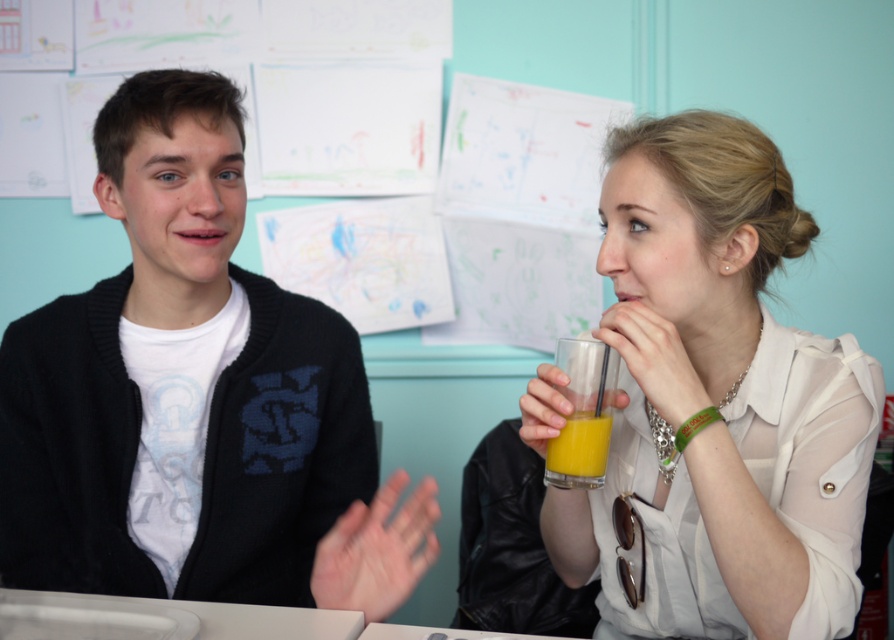
Does white glossy shirt at upper right come in front of translucent glass of orange juice at center?

Yes, it is.

Between white glossy shirt at upper right and translucent glass of orange juice at center, which one appears on the left side from the viewer's perspective?

Positioned to the left is translucent glass of orange juice at center.

I want to click on white glossy shirt at upper right, so click(x=718, y=401).

Is point (114, 120) farther from viewer compared to point (85, 595)?

Yes.

Which is in front, point (97, 160) or point (171, 605)?

Point (171, 605) is in front.

You are a GUI agent. You are given a task and a screenshot of the screen. Output one action in this format:
    pyautogui.click(x=<x>, y=<y>)
    Task: Click on the black matte sweater at center
    
    Given the screenshot: What is the action you would take?
    pyautogui.click(x=195, y=400)

You are a GUI agent. You are given a task and a screenshot of the screen. Output one action in this format:
    pyautogui.click(x=<x>, y=<y>)
    Task: Click on the black matte sweater at center
    
    Given the screenshot: What is the action you would take?
    pyautogui.click(x=195, y=400)

Does white glossy table at center lie in front of orange liquid glass at center?

Yes, white glossy table at center is in front of orange liquid glass at center.

Who is more forward, (182, 612) or (578, 348)?

Point (182, 612)

Where is `white glossy table at center`? The image size is (894, 640). white glossy table at center is located at coordinates (163, 618).